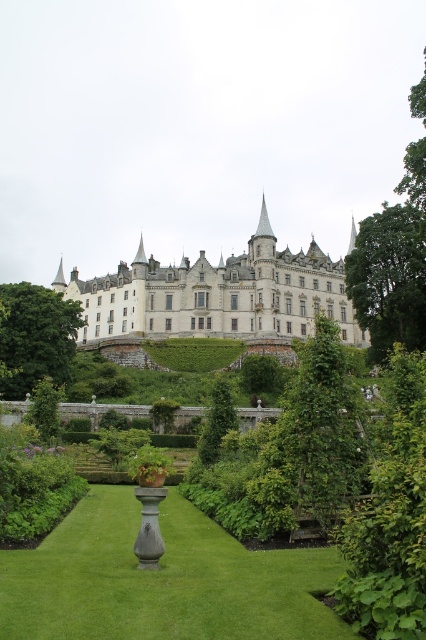
You are a visitor standing in the garden of the castle. You see the green grass at center and the white stone castle at center. Which object is closer to you?

The green grass at center is closer to you because it is in front of the white stone castle at center.

Based on the photo, you are standing in the garden of the castle and want to take a photo of the white stone castle at center and the green leafy hedge at lower left. Which object should you point your camera towards first if you want to capture both in the frame?

You should point your camera towards the green leafy hedge at lower left first because the white stone castle at center is above it, so adjusting the angle to include both would require framing from the lower left upwards.